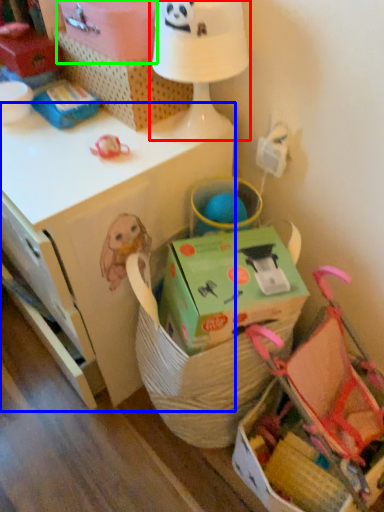
Question: Which is farther away from table lamp (highlighted by a red box)? desk (highlighted by a blue box) or cardboard box (highlighted by a green box)?

Choices:
 (A) desk
 (B) cardboard box

Answer: (A)